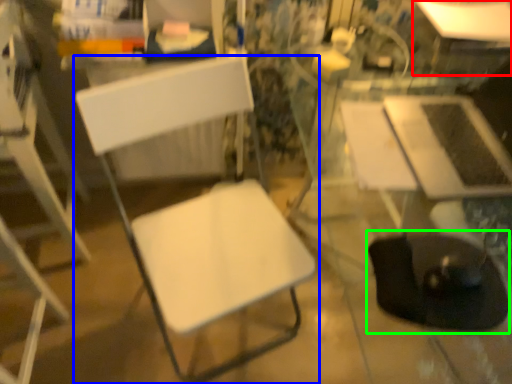
Question: Estimate the real-world distances between objects in this image. Which object is closer to table (highlighted by a red box), chair (highlighted by a blue box) or swivel chair (highlighted by a green box)?

Choices:
 (A) chair
 (B) swivel chair

Answer: (B)